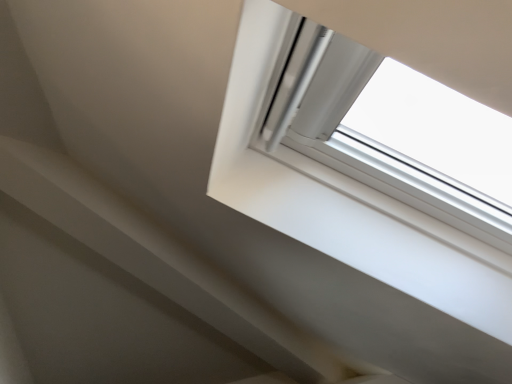
This screenshot has width=512, height=384. Describe the element at coordinates (345, 204) in the screenshot. I see `white plastic window at upper right` at that location.

Locate an element on the screen. Image resolution: width=512 pixels, height=384 pixels. white plastic window at upper right is located at coordinates (345, 204).

The height and width of the screenshot is (384, 512). I want to click on white plastic window at upper right, so click(x=345, y=204).